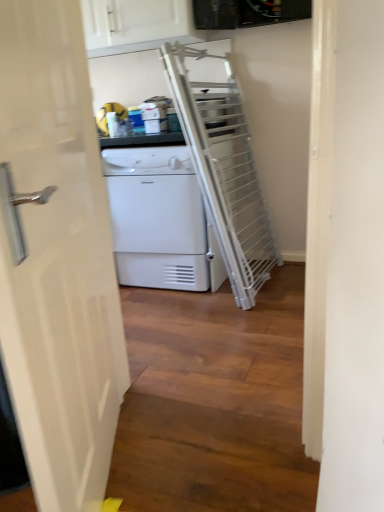
Question: Can you confirm if white matte/texture dryer at center is shorter than white glossy door at left?

Choices:
 (A) yes
 (B) no

Answer: (A)

Question: From a real-world perspective, is white matte/texture dryer at center located higher than white glossy door at left?

Choices:
 (A) no
 (B) yes

Answer: (A)

Question: Considering the relative sizes of white matte/texture dryer at center and white glossy door at left in the image provided, is white matte/texture dryer at center bigger than white glossy door at left?

Choices:
 (A) no
 (B) yes

Answer: (B)

Question: Is white matte/texture dryer at center next to white glossy door at left?

Choices:
 (A) yes
 (B) no

Answer: (B)

Question: Is there a large distance between white matte/texture dryer at center and white glossy door at left?

Choices:
 (A) no
 (B) yes

Answer: (B)

Question: Is white matte/texture dryer at center at the left side of white glossy door at left?

Choices:
 (A) yes
 (B) no

Answer: (B)

Question: Is the depth of white matte/texture dryer at center less than that of white glossy cabinet at upper center?

Choices:
 (A) yes
 (B) no

Answer: (A)

Question: Does white matte/texture dryer at center lie behind white glossy cabinet at upper center?

Choices:
 (A) yes
 (B) no

Answer: (B)

Question: Is white glossy cabinet at upper center inside white matte/texture dryer at center?

Choices:
 (A) no
 (B) yes

Answer: (A)

Question: Would you say white matte/texture dryer at center is a long distance from white glossy cabinet at upper center?

Choices:
 (A) yes
 (B) no

Answer: (B)

Question: Considering the relative sizes of white matte/texture dryer at center and white glossy cabinet at upper center in the image provided, is white matte/texture dryer at center bigger than white glossy cabinet at upper center?

Choices:
 (A) no
 (B) yes

Answer: (B)

Question: Does white matte/texture dryer at center have a lesser width compared to white glossy cabinet at upper center?

Choices:
 (A) yes
 (B) no

Answer: (B)

Question: Is white glossy door at left positioned in front of white matte/texture dryer at center?

Choices:
 (A) no
 (B) yes

Answer: (B)